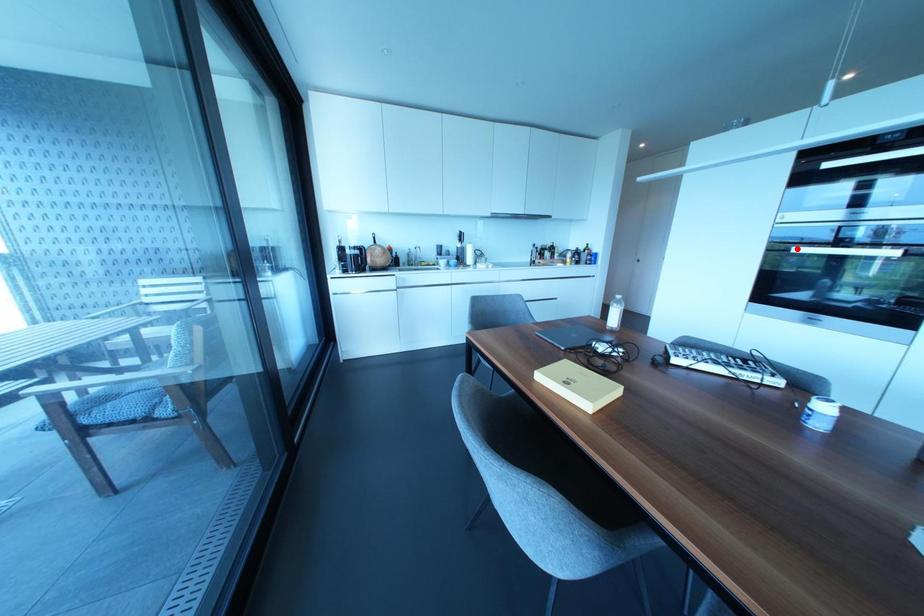
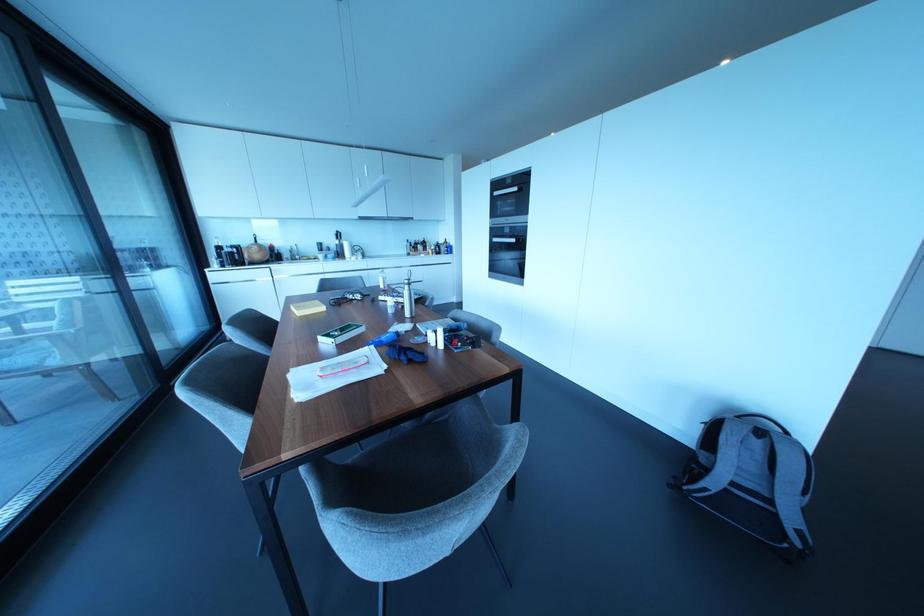
Locate, in the second image, the point that corresponds to the highlighted location in the first image.

(493, 238)